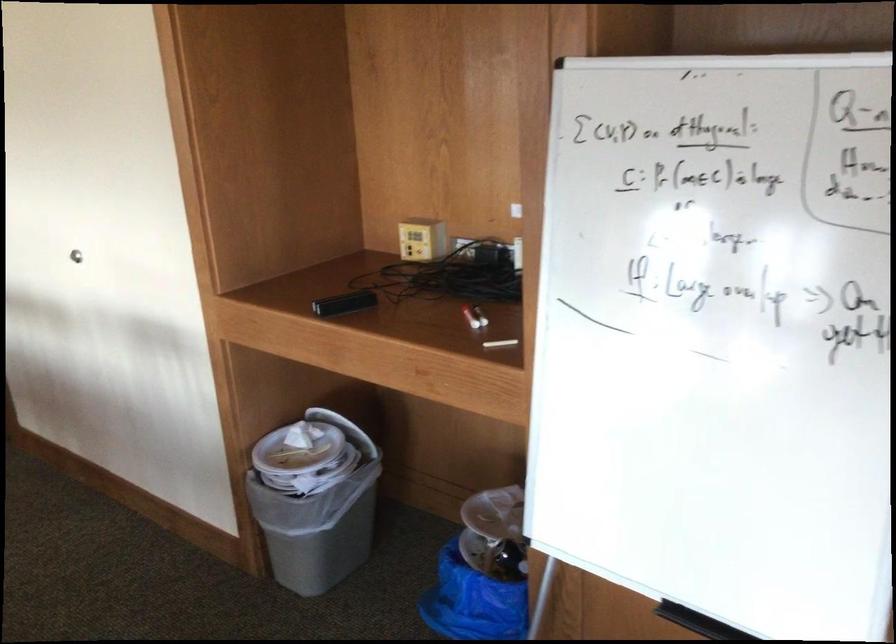
The image size is (896, 644). What do you see at coordinates (76, 254) in the screenshot?
I see `the silver door knob` at bounding box center [76, 254].